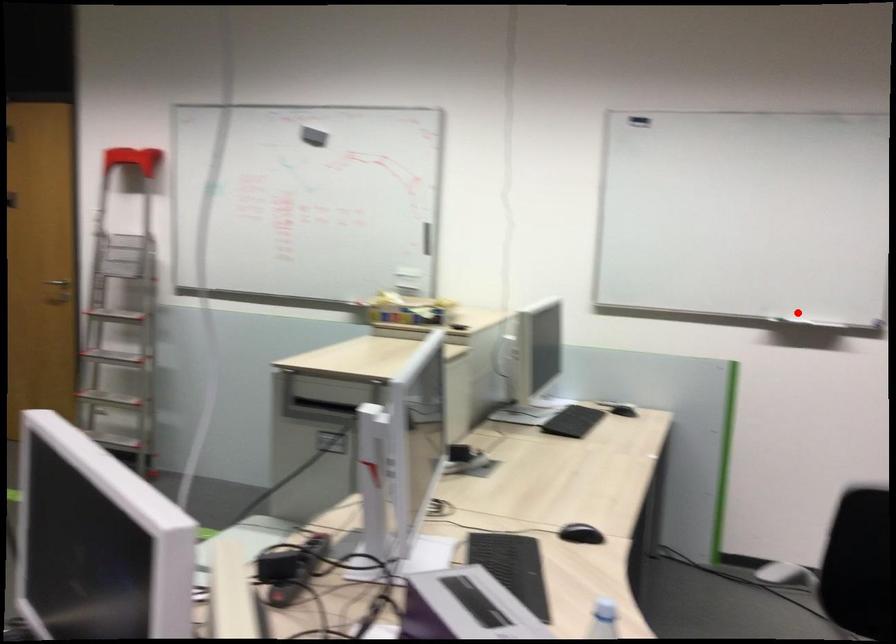
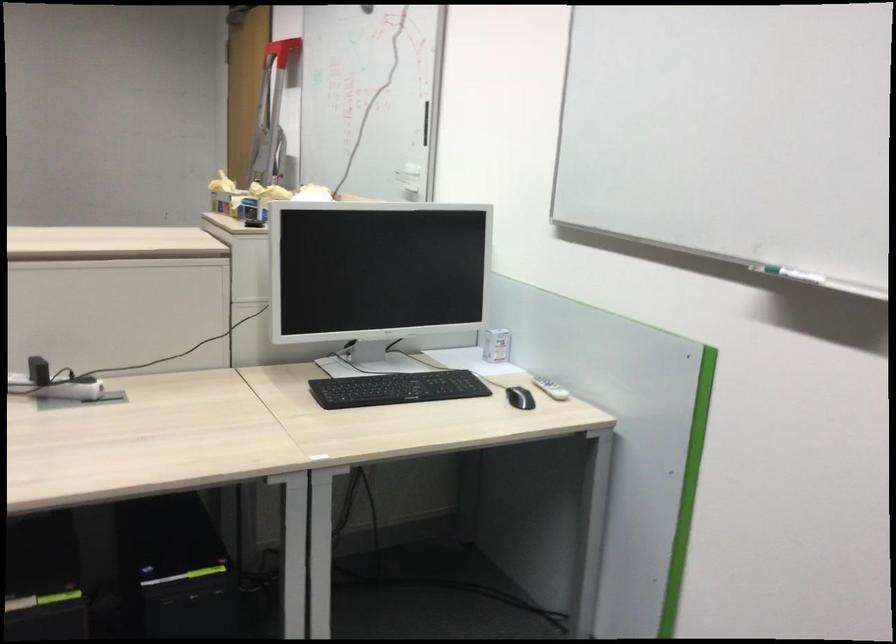
The point at the highlighted location is marked in the first image. Where is the corresponding point in the second image?

(794, 275)